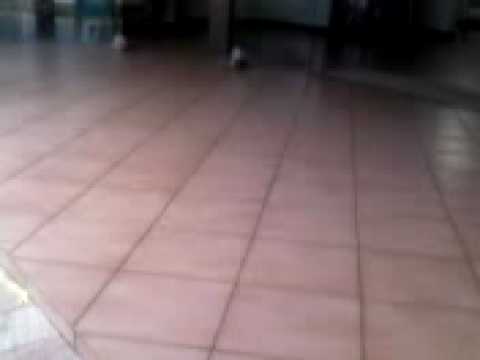
The width and height of the screenshot is (480, 360). I want to click on floor, so point(239,210).